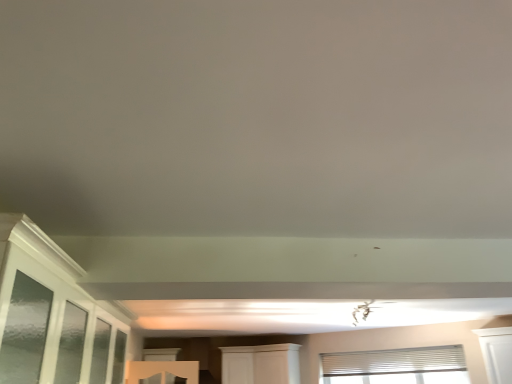
Question: Considering the relative positions of white wood cabinet at center and white textured blinds at upper right, marked as the 2th window in a left-to-right arrangement, in the image provided, is white wood cabinet at center behind white textured blinds at upper right, marked as the 2th window in a left-to-right arrangement,?

Choices:
 (A) no
 (B) yes

Answer: (B)

Question: Does white wood cabinet at center have a smaller size compared to white textured blinds at upper right, the 1th window in the right-to-left sequence?

Choices:
 (A) yes
 (B) no

Answer: (B)

Question: Would you say white wood cabinet at center contains white textured blinds at upper right, marked as the 2th window in a left-to-right arrangement?

Choices:
 (A) no
 (B) yes

Answer: (A)

Question: Would you say white wood cabinet at center is outside white textured blinds at upper right, the 1th window in the right-to-left sequence?

Choices:
 (A) no
 (B) yes

Answer: (B)

Question: Considering the relative sizes of white wood cabinet at center and white textured blinds at upper right, the 1th window in the right-to-left sequence, in the image provided, is white wood cabinet at center thinner than white textured blinds at upper right, the 1th window in the right-to-left sequence,?

Choices:
 (A) no
 (B) yes

Answer: (A)

Question: From a real-world perspective, is white wood cabinet at center positioned above or below white textured blinds at upper right, the 1th window in the right-to-left sequence?

Choices:
 (A) above
 (B) below

Answer: (A)

Question: From their relative heights in the image, would you say white wood cabinet at center is taller or shorter than white textured blinds at upper right, the 1th window in the right-to-left sequence?

Choices:
 (A) tall
 (B) short

Answer: (A)

Question: Is point (297, 347) closer or farther from the camera than point (415, 382)?

Choices:
 (A) farther
 (B) closer

Answer: (A)

Question: Considering the positions of white wood cabinet at center and white textured blinds at upper right, marked as the 2th window in a left-to-right arrangement, in the image, is white wood cabinet at center wider or thinner than white textured blinds at upper right, marked as the 2th window in a left-to-right arrangement,?

Choices:
 (A) thin
 (B) wide

Answer: (B)

Question: Would you say clear glass window at lower center, which is the 2th window from right to left, is to the left or to the right of white textured blinds at upper right, marked as the 2th window in a left-to-right arrangement, in the picture?

Choices:
 (A) right
 (B) left

Answer: (B)

Question: From their relative heights in the image, would you say clear glass window at lower center, which is the 2th window from right to left, is taller or shorter than white textured blinds at upper right, the 1th window in the right-to-left sequence?

Choices:
 (A) tall
 (B) short

Answer: (A)

Question: Is clear glass window at lower center, the 1th window in the left-to-right sequence, inside or outside of white textured blinds at upper right, marked as the 2th window in a left-to-right arrangement?

Choices:
 (A) outside
 (B) inside

Answer: (A)

Question: Looking at the image, does clear glass window at lower center, the 1th window in the left-to-right sequence, seem bigger or smaller compared to white textured blinds at upper right, the 1th window in the right-to-left sequence?

Choices:
 (A) small
 (B) big

Answer: (B)

Question: Considering their positions, is white textured blinds at upper right, marked as the 2th window in a left-to-right arrangement, located in front of or behind clear glass window at lower center, which is the 2th window from right to left?

Choices:
 (A) behind
 (B) front

Answer: (B)

Question: From a real-world perspective, is white textured blinds at upper right, the 1th window in the right-to-left sequence, physically located above or below clear glass window at lower center, which is the 2th window from right to left?

Choices:
 (A) below
 (B) above

Answer: (A)